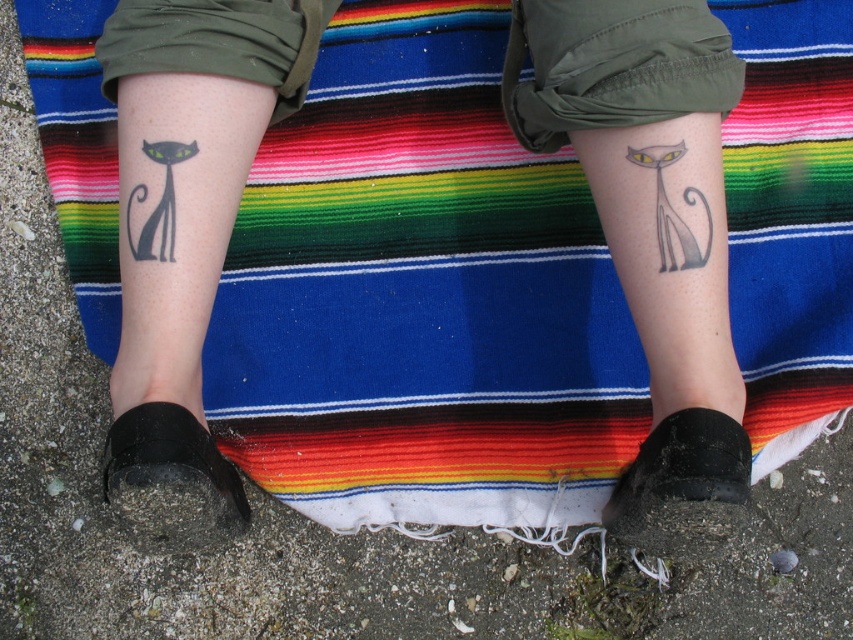
You are a tattoo artist assessing the placement of the gray ink cat tattoo at lower center and the black matte cat at left on a client. Given their sizes, which tattoo would require more vertical space to accommodate its design?

The gray ink cat tattoo at lower center requires more vertical space because it has a greater height compared to the black matte cat at left.

You are a tattoo artist examining the person from the front. You need to determine which tattoo is closer to you between the black matte tattoo at lower left and the black matte cat at left. Which one is closer?

The black matte tattoo at lower left is closer to you because it is in front of the black matte cat at left.

You are a photographer taking a close up of the legs and want to focus on the tattoos. Which tattoo, the black ink cat at right or the black matte cat at left, will be in focus if you focus on the one closer to the camera?

The black ink cat at right is closer to the viewer than the black matte cat at left, so focusing on the closer one would put the black ink cat at right in focus.